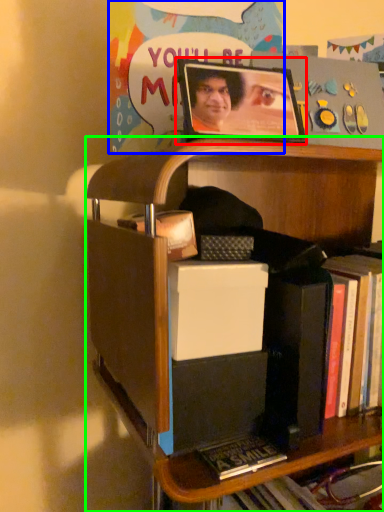
Question: Which object is the farthest from picture frame (highlighted by a red box)? Choose among these: postcard (highlighted by a blue box) or shelf (highlighted by a green box).

Choices:
 (A) postcard
 (B) shelf

Answer: (B)